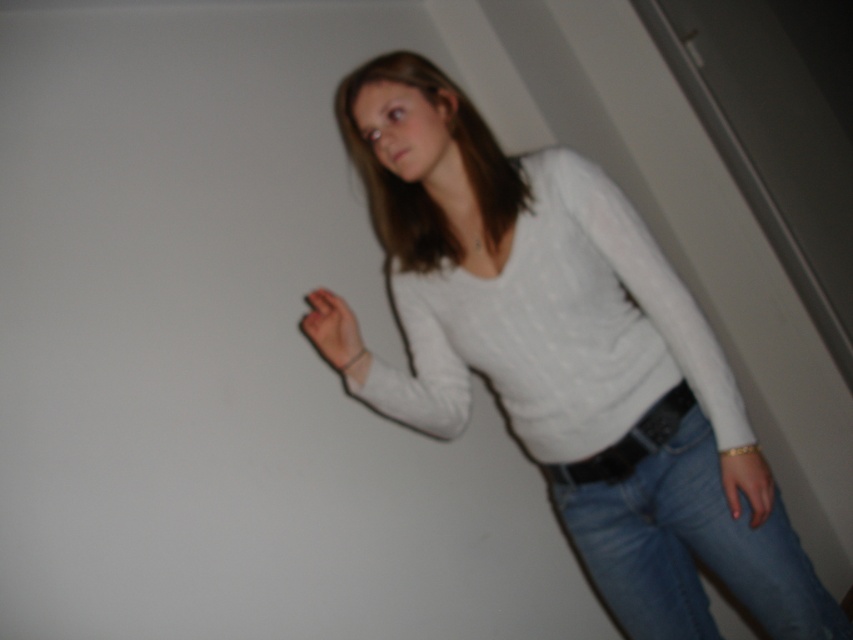
Which of these two, white knitted sweater at center or matte gold bracelet at lower right, stands taller?

white knitted sweater at center

Who is positioned more to the left, white knitted sweater at center or matte gold bracelet at lower right?

Positioned to the left is white knitted sweater at center.

Does point (556, 253) come closer to viewer compared to point (737, 452)?

No, it is not.

The width and height of the screenshot is (853, 640). What are the coordinates of `white knitted sweater at center` in the screenshot? It's located at (558, 326).

Is point (706, 340) farther from viewer compared to point (624, 454)?

No, (706, 340) is closer to viewer.

Between white knitted sweater at center and black leather belt at center, which one is positioned higher?

white knitted sweater at center is higher up.

Who is more forward, [664,372] or [662,397]?

Point [662,397] is in front.

I want to click on white knitted sweater at center, so click(558, 326).

Does white knitwear at center have a smaller size compared to black leather belt at center?

Incorrect, white knitwear at center is not smaller in size than black leather belt at center.

Is white knitwear at center positioned in front of black leather belt at center?

That is True.

Which is in front, point (404, 333) or point (683, 385)?

Positioned in front is point (683, 385).

Where is `white knitwear at center`? The width and height of the screenshot is (853, 640). white knitwear at center is located at coordinates (567, 355).